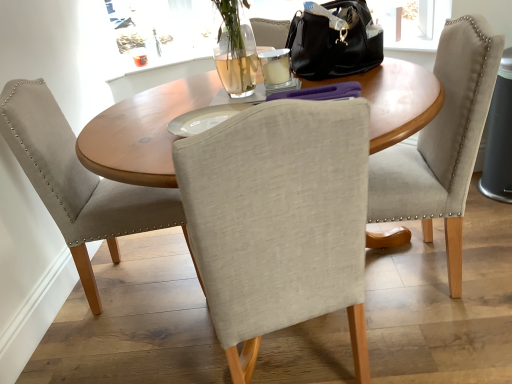
I want to click on free space below light gray fabric chair at left, the 2th chair positioned from the right (from a real-world perspective), so click(x=153, y=275).